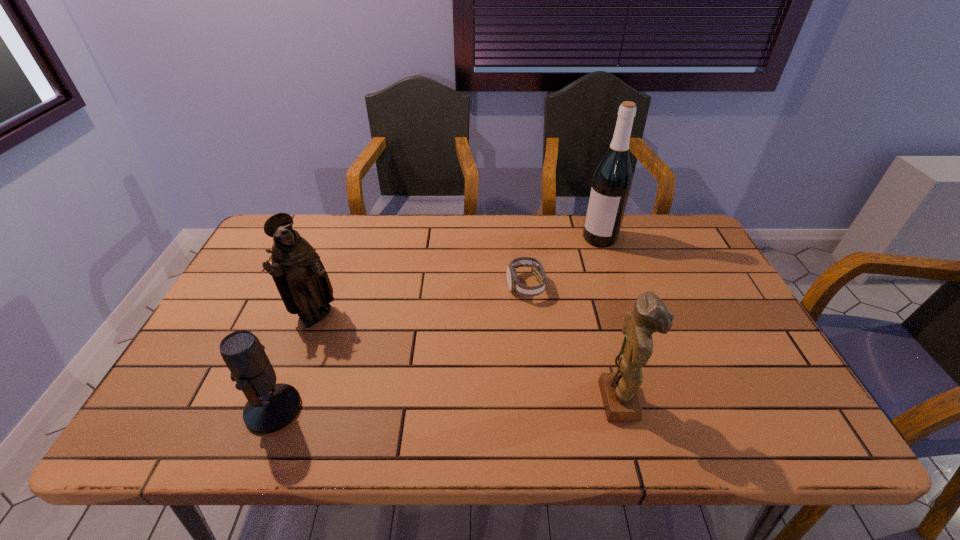
Identify the location of vacant area between the nearer figurine and the second shortest object. Image resolution: width=960 pixels, height=540 pixels. (447, 405).

Locate an element on the screen. The image size is (960, 540). free spot between the farthest object and the farther figurine is located at coordinates (458, 277).

Where is `vacant space that's between the wine bottle and the third object from right to left`? The width and height of the screenshot is (960, 540). vacant space that's between the wine bottle and the third object from right to left is located at coordinates (563, 262).

At what (x,y) coordinates should I click in order to perform the action: click on vacant space that's between the farthest object and the second farthest object. Please return your answer as a coordinate pair (x, y). Image resolution: width=960 pixels, height=540 pixels. Looking at the image, I should click on (563, 262).

The image size is (960, 540). I want to click on free area in between the third object from left to right and the microphone, so click(x=399, y=348).

Locate an element on the screen. vacant space that's between the third object from left to right and the farther figurine is located at coordinates (420, 301).

Image resolution: width=960 pixels, height=540 pixels. I want to click on vacant space in between the watch and the nearer figurine, so click(x=573, y=343).

Where is `unoccupied area between the microphone and the right figurine`? The height and width of the screenshot is (540, 960). unoccupied area between the microphone and the right figurine is located at coordinates (447, 405).

Locate which object ranks fourth in proximity to the farther figurine. Please provide its 2D coordinates. Your answer should be formatted as a tuple, i.e. [(x, y)], where the tuple contains the x and y coordinates of a point satisfying the conditions above.

[(612, 180)]

Where is `the third closest object to the left figurine`? the third closest object to the left figurine is located at coordinates (619, 394).